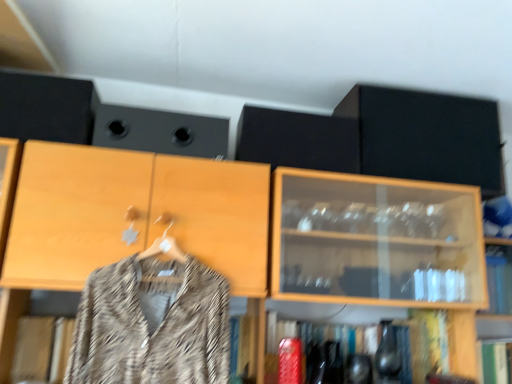
Question: Based on their sizes in the image, would you say shiny metallic vase at lower center is bigger or smaller than black matte cabinet at upper right?

Choices:
 (A) big
 (B) small

Answer: (B)

Question: Is shiny metallic vase at lower center in front of or behind black matte cabinet at upper right in the image?

Choices:
 (A) behind
 (B) front

Answer: (B)

Question: Which object is the closest to the black matte speaker at upper center, which is the first speaker from left to right?

Choices:
 (A) black matte cabinet at upper right
 (B) shiny metallic vase at lower center
 (C) patterned fabric coat at center
 (D) black matte speaker at upper center, positioned as the first speaker in right-to-left order

Answer: (D)

Question: Estimate the real-world distances between objects in this image. Which object is closer to the shiny metallic vase at lower center?

Choices:
 (A) black matte speaker at upper center, which is the second speaker in right-to-left order
 (B) patterned fabric coat at center
 (C) black matte cabinet at upper right
 (D) black matte speaker at upper center, positioned as the first speaker in right-to-left order

Answer: (B)